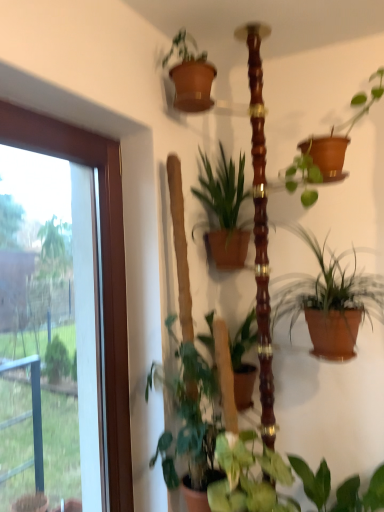
Question: Does green matte plant at lower left, which is the 2th houseplant in bottom-to-top order, have a lesser height compared to terracotta clay pot at center-right, positioned as the 2th houseplant in top-to-bottom order?

Choices:
 (A) no
 (B) yes

Answer: (A)

Question: Is green matte plant at lower left, which is the third houseplant in top-to-bottom order, smaller than terracotta clay pot at center-right, which is the 3th houseplant from bottom to top?

Choices:
 (A) yes
 (B) no

Answer: (A)

Question: Is terracotta clay pot at center-right, positioned as the 2th houseplant in top-to-bottom order, at the back of green matte plant at lower left, which is the third houseplant in top-to-bottom order?

Choices:
 (A) no
 (B) yes

Answer: (A)

Question: From the image's perspective, does green matte plant at lower left, which is the third houseplant in top-to-bottom order, appear lower than terracotta clay pot at center-right, positioned as the 2th houseplant in top-to-bottom order?

Choices:
 (A) no
 (B) yes

Answer: (B)

Question: Is terracotta clay pot at center-right, which is the 3th houseplant from bottom to top, a part of green matte plant at lower left, which is the third houseplant in top-to-bottom order?

Choices:
 (A) yes
 (B) no

Answer: (B)

Question: From the image's perspective, is green matte plant at center, the 1th houseplant positioned from the top, positioned above or below transparent glass door at left?

Choices:
 (A) above
 (B) below

Answer: (A)

Question: Would you say green matte plant at center, which ranks as the 4th houseplant in bottom-to-top order, is inside or outside transparent glass door at left?

Choices:
 (A) outside
 (B) inside

Answer: (A)

Question: Is green matte plant at center, which ranks as the 4th houseplant in bottom-to-top order, wider or thinner than transparent glass door at left?

Choices:
 (A) wide
 (B) thin

Answer: (A)

Question: Considering their positions, is green matte plant at center, the 1th houseplant positioned from the top, located in front of or behind transparent glass door at left?

Choices:
 (A) front
 (B) behind

Answer: (B)

Question: From the image's perspective, is green matte plant at lower left, which is the 2th houseplant in bottom-to-top order, located above or below green glossy plant at center, arranged as the fourth houseplant when viewed from the top?

Choices:
 (A) above
 (B) below

Answer: (A)

Question: Looking at their shapes, would you say green matte plant at lower left, which is the 2th houseplant in bottom-to-top order, is wider or thinner than green glossy plant at center, arranged as the fourth houseplant when viewed from the top?

Choices:
 (A) thin
 (B) wide

Answer: (A)

Question: Would you say green matte plant at lower left, which is the third houseplant in top-to-bottom order, is inside or outside green glossy plant at center, positioned as the 1th houseplant in bottom-to-top order?

Choices:
 (A) outside
 (B) inside

Answer: (A)

Question: In the image, is green matte plant at lower left, which is the third houseplant in top-to-bottom order, positioned in front of or behind green glossy plant at center, arranged as the fourth houseplant when viewed from the top?

Choices:
 (A) front
 (B) behind

Answer: (B)

Question: Looking at the image, does green matte plant at center, the 1th houseplant positioned from the top, seem bigger or smaller compared to terracotta clay pot at center-right, positioned as the 2th houseplant in top-to-bottom order?

Choices:
 (A) big
 (B) small

Answer: (B)

Question: From the image's perspective, is green matte plant at center, which ranks as the 4th houseplant in bottom-to-top order, positioned above or below terracotta clay pot at center-right, which is the 3th houseplant from bottom to top?

Choices:
 (A) below
 (B) above

Answer: (B)